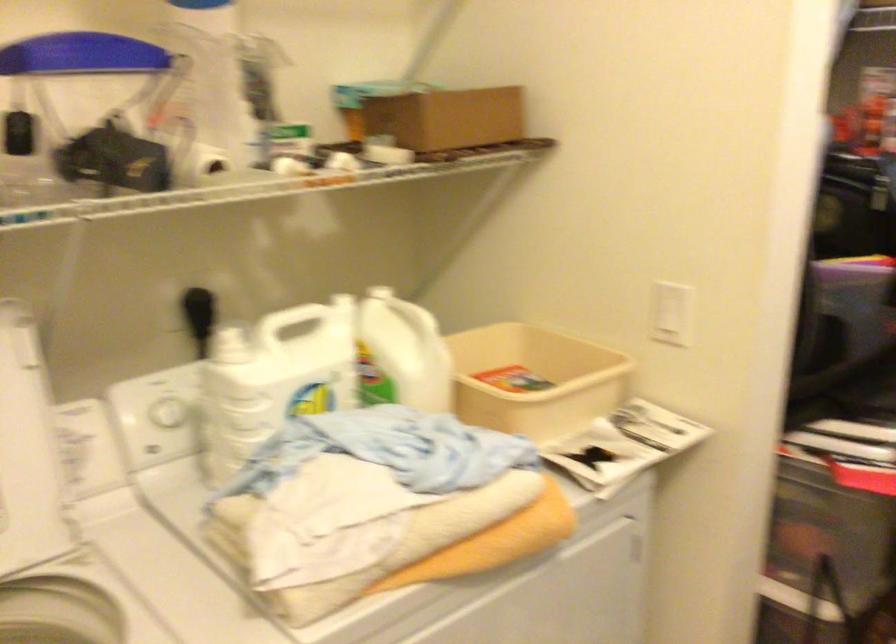
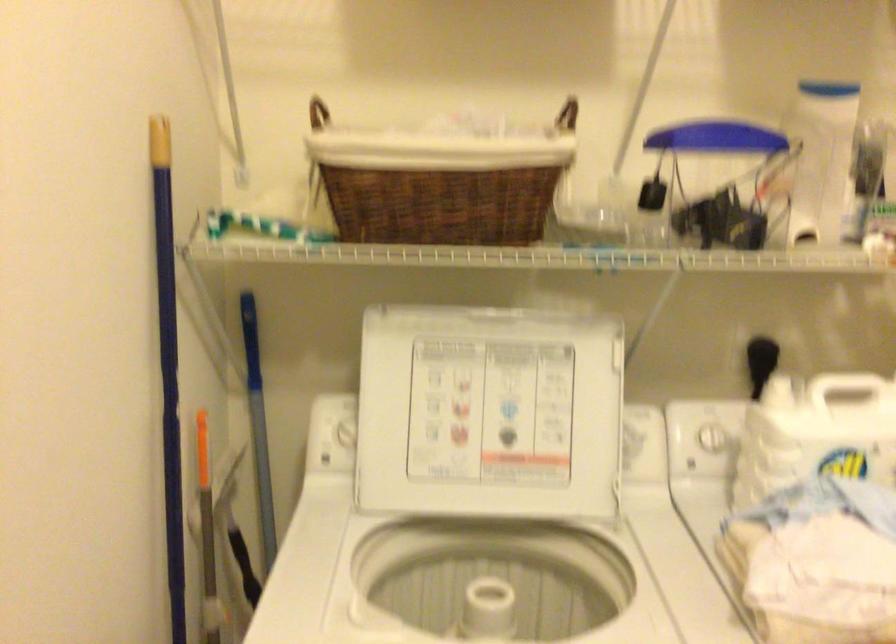
Question: Based on the continuous images, in which direction is the camera rotating? Reply with the corresponding letter.

Choices:
 (A) Left
 (B) Right
 (C) Up
 (D) Down

Answer: (A)